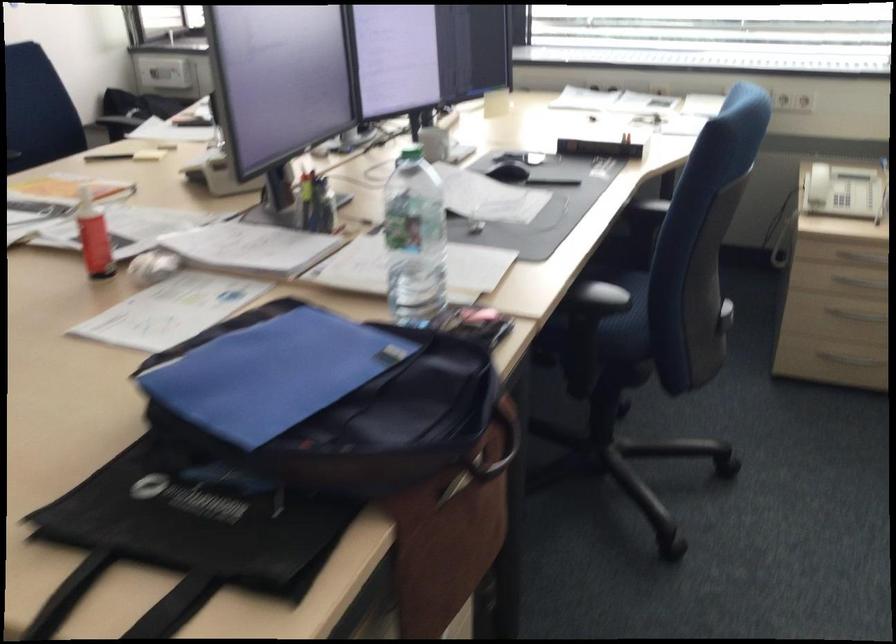
What do you see at coordinates (849, 355) in the screenshot? The width and height of the screenshot is (896, 644). I see `the drawer handle` at bounding box center [849, 355].